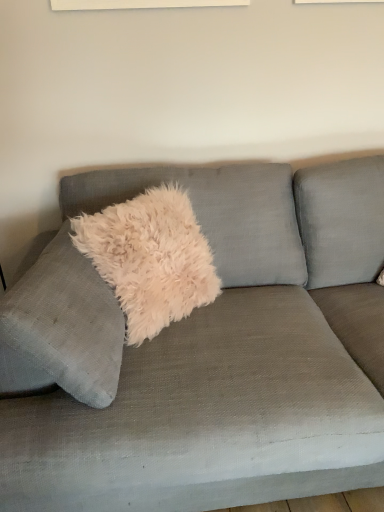
The height and width of the screenshot is (512, 384). I want to click on textured gray couch at center, so click(209, 352).

What do you see at coordinates (209, 352) in the screenshot? The width and height of the screenshot is (384, 512). I see `textured gray couch at center` at bounding box center [209, 352].

I want to click on textured gray couch at center, so click(209, 352).